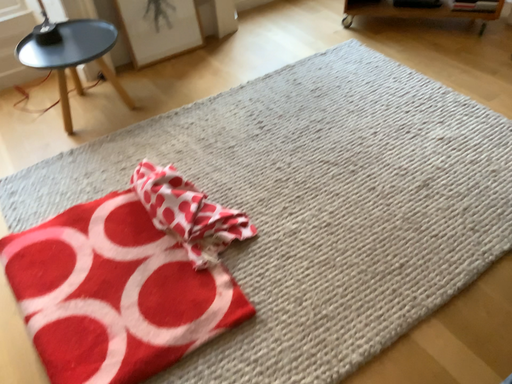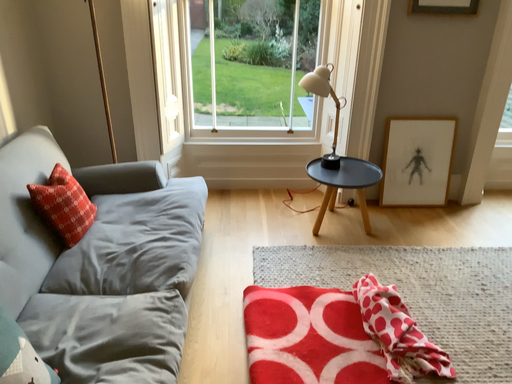
Question: How did the camera likely rotate when shooting the video?

Choices:
 (A) rotated right
 (B) rotated left

Answer: (B)